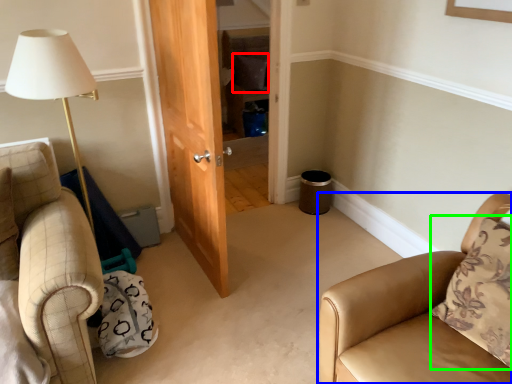
Question: Which object is the closest to the pillow (highlighted by a red box)? Choose among these: chair (highlighted by a blue box) or pillow (highlighted by a green box).

Choices:
 (A) chair
 (B) pillow

Answer: (A)